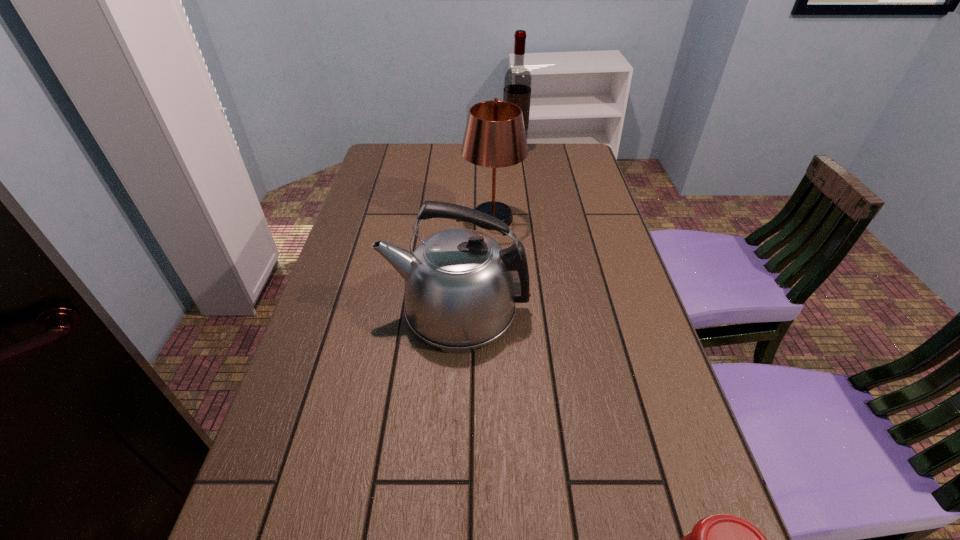
At what (x,y) coordinates should I click in order to perform the action: click on the farthest object. Please return your answer as a coordinate pair (x, y). Image resolution: width=960 pixels, height=540 pixels. Looking at the image, I should click on (518, 80).

This screenshot has height=540, width=960. In order to click on lampshade in this screenshot , I will do `click(495, 137)`.

Locate an element on the screen. kettle is located at coordinates (461, 288).

Where is `the second nearest object`? The height and width of the screenshot is (540, 960). the second nearest object is located at coordinates (461, 288).

You are a GUI agent. You are given a task and a screenshot of the screen. Output one action in this format:
    pyautogui.click(x=<x>, y=<y>)
    Task: Click on the free location located 0.390m on the front of the wine bottle
    The height and width of the screenshot is (540, 960).
    Given the screenshot: What is the action you would take?
    point(522,218)

Identify the location of vacant space positioned 0.060m on the front-facing side of the lampshade. pyautogui.click(x=437, y=218).

Image resolution: width=960 pixels, height=540 pixels. Identify the location of vacant space located 0.140m on the front-facing side of the lampshade. point(411,218).

Where is `free space located 0.270m on the front-facing side of the lampshade`? free space located 0.270m on the front-facing side of the lampshade is located at coordinates (368, 218).

This screenshot has height=540, width=960. What are the coordinates of `vacant space positioned on the spout of the kettle` in the screenshot? It's located at (327, 309).

Where is `free spot located 0.050m on the spout of the kettle`? This screenshot has height=540, width=960. free spot located 0.050m on the spout of the kettle is located at coordinates (365, 309).